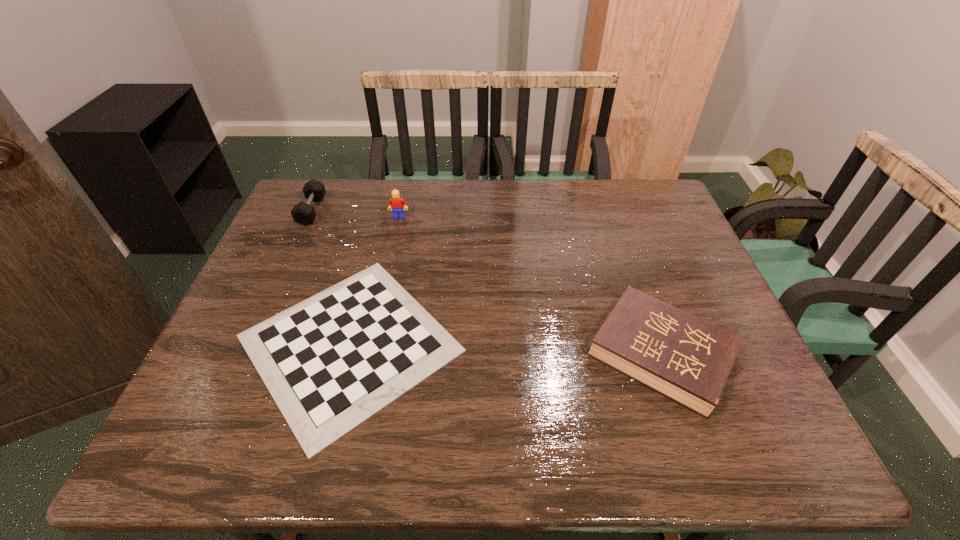
What are the coordinates of `dumbbell present at the far edge` in the screenshot? It's located at (303, 213).

The image size is (960, 540). I want to click on hardback book that is at the near edge, so click(x=684, y=358).

Where is `chessboard positioned at the near edge`? The width and height of the screenshot is (960, 540). chessboard positioned at the near edge is located at coordinates (330, 362).

Find the location of a particular element. The image size is (960, 540). dumbbell at the left edge is located at coordinates (303, 213).

You are a GUI agent. You are given a task and a screenshot of the screen. Output one action in this format:
    pyautogui.click(x=<x>, y=<y>)
    Task: Click on the chessboard that is at the left edge
    This screenshot has height=540, width=960.
    Given the screenshot: What is the action you would take?
    pyautogui.click(x=330, y=362)

Identify the location of object positioned at the right edge. The image size is (960, 540). (684, 358).

Where is `object at the far left corner`? This screenshot has height=540, width=960. object at the far left corner is located at coordinates (303, 213).

At what (x,y) coordinates should I click in order to perform the action: click on object positioned at the near left corner. Please return your answer as a coordinate pair (x, y). Looking at the image, I should click on (330, 362).

I want to click on object that is at the near right corner, so point(684,358).

In the image, there is a desktop. What are the coordinates of `vacant area at the far edge` in the screenshot? It's located at (503, 186).